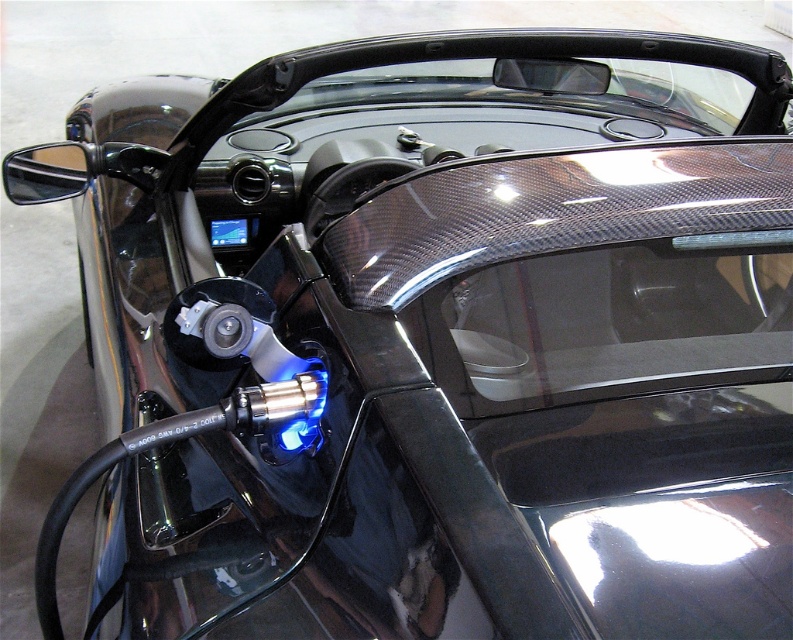
Does point (508, 346) come farther from viewer compared to point (705, 102)?

No, it is not.

Is transparent carbon fiber windshield at center shorter than transparent carbon fiber windshield at upper center?

Indeed, transparent carbon fiber windshield at center has a lesser height compared to transparent carbon fiber windshield at upper center.

Between point (515, 374) and point (481, 61), which one is positioned behind?

Positioned behind is point (481, 61).

Locate an element on the screen. transparent carbon fiber windshield at center is located at coordinates (606, 321).